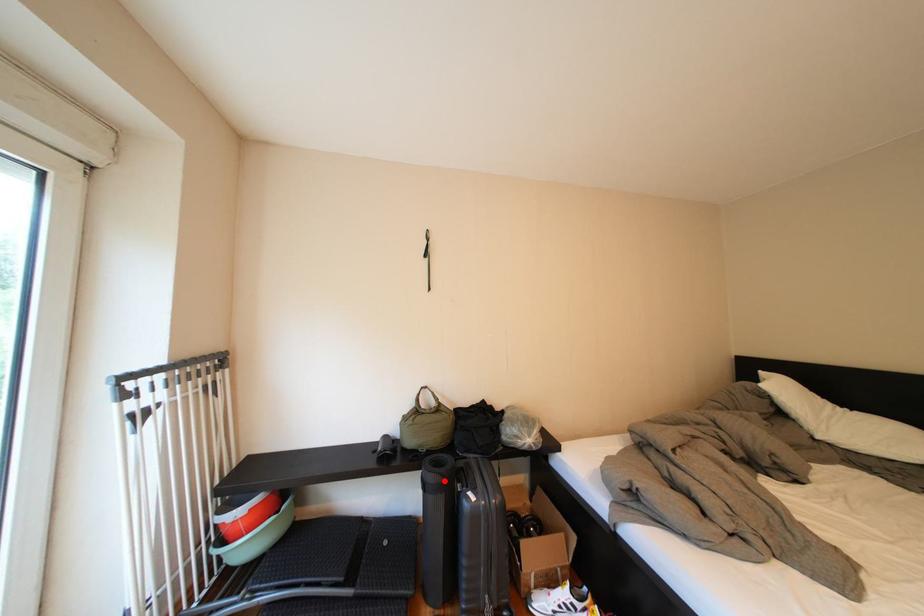
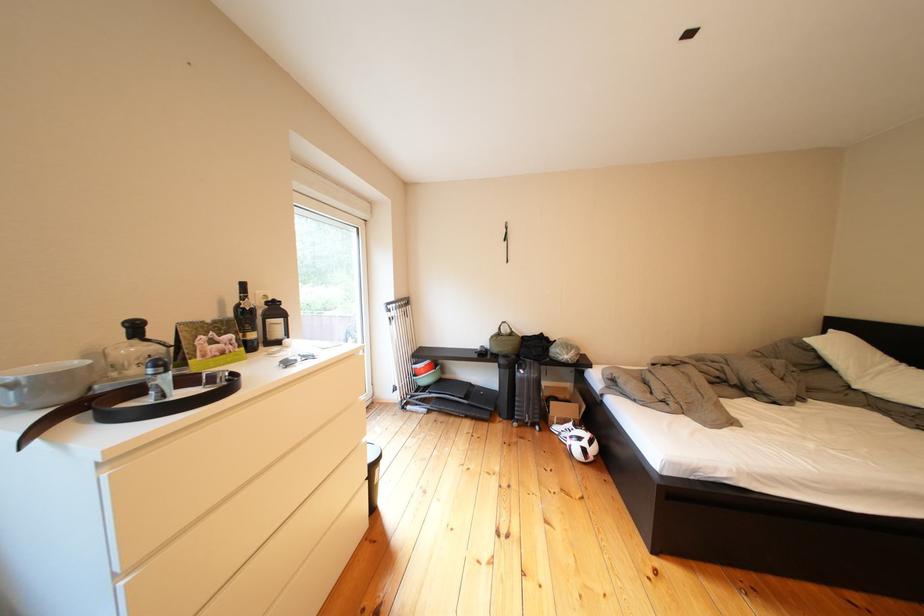
Find the pixel in the second image that matches the highlighted location in the first image.

(516, 366)